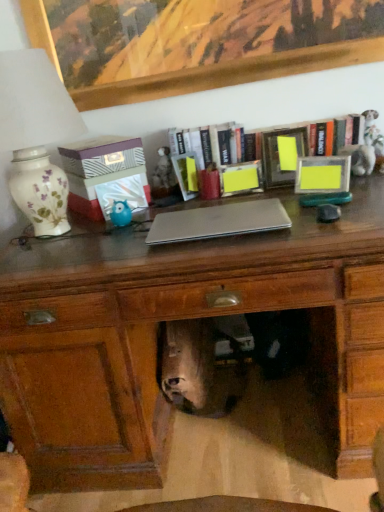
Find the location of a particular element. The width and height of the screenshot is (384, 512). free location in front of matte blue plastic owl at center-left is located at coordinates (107, 239).